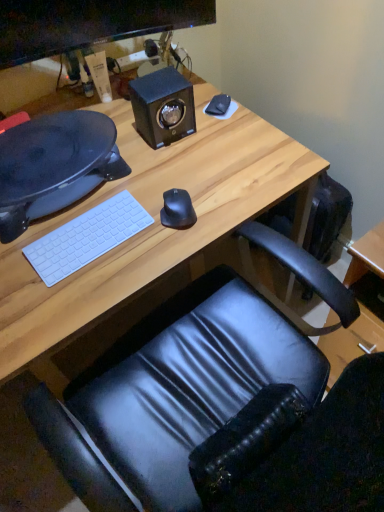
I want to click on free location in front of black matte notepad at upper right, so click(x=224, y=140).